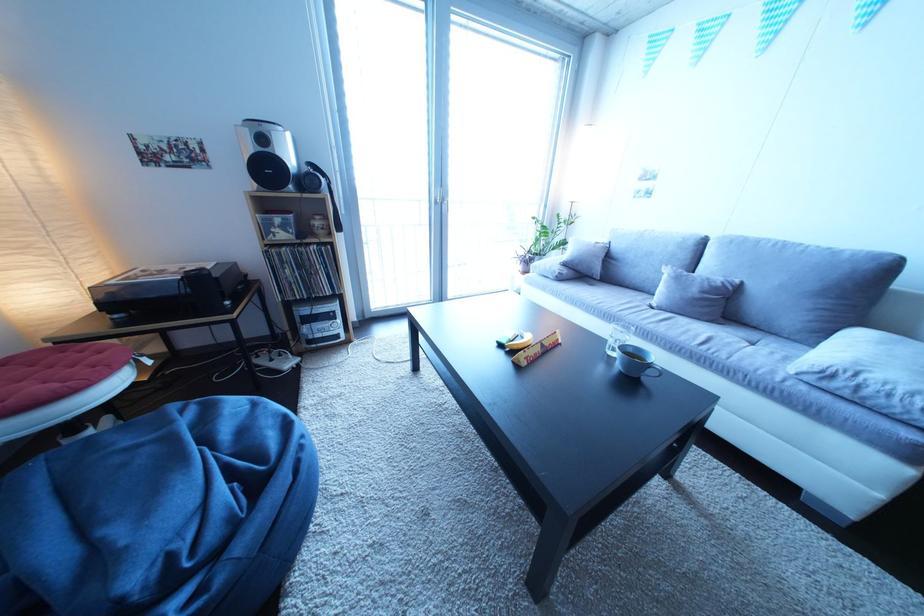
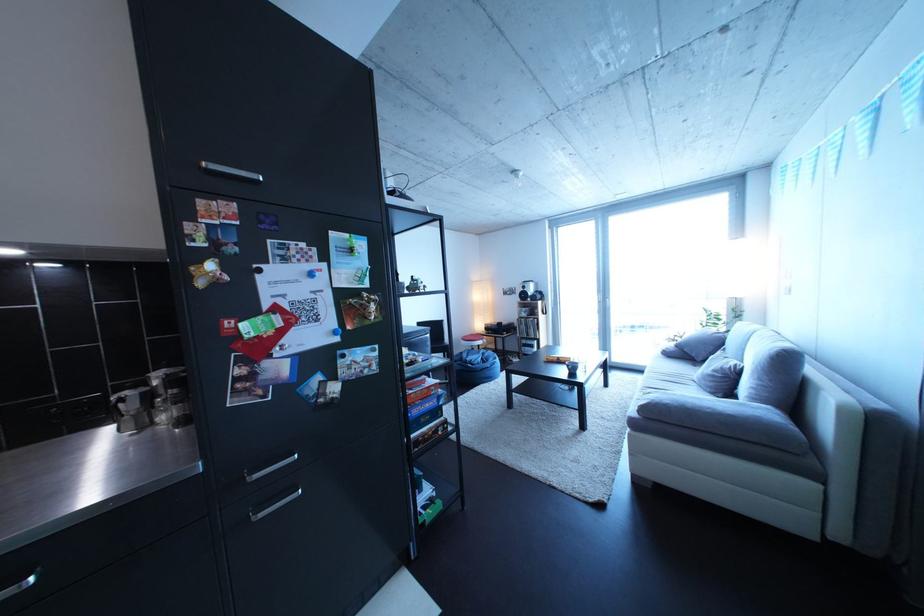
Where in the second image is the point corresponding to point (574, 285) from the first image?

(682, 361)